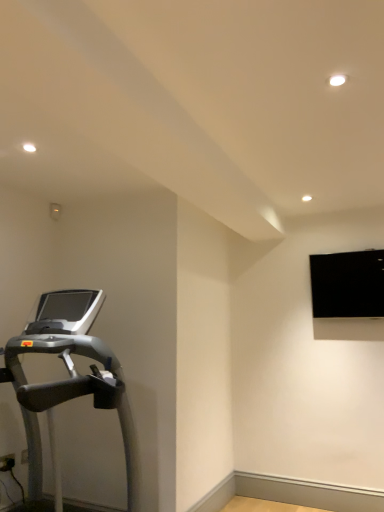
Question: Should I look upward or downward to see black matte projection screen at upper right?

Choices:
 (A) up
 (B) down

Answer: (B)

Question: Does black matte projection screen at upper right have a smaller size compared to silver metallic treadmill at left?

Choices:
 (A) yes
 (B) no

Answer: (A)

Question: From the image's perspective, is black matte projection screen at upper right over silver metallic treadmill at left?

Choices:
 (A) yes
 (B) no

Answer: (A)

Question: Is black matte projection screen at upper right far from silver metallic treadmill at left?

Choices:
 (A) yes
 (B) no

Answer: (A)

Question: Does black matte projection screen at upper right appear on the right side of silver metallic treadmill at left?

Choices:
 (A) yes
 (B) no

Answer: (A)

Question: From a real-world perspective, is black matte projection screen at upper right physically below silver metallic treadmill at left?

Choices:
 (A) no
 (B) yes

Answer: (A)

Question: Can you confirm if black matte projection screen at upper right is wider than silver metallic treadmill at left?

Choices:
 (A) no
 (B) yes

Answer: (A)

Question: Is silver metallic treadmill at left shorter than black matte projection screen at upper right?

Choices:
 (A) yes
 (B) no

Answer: (B)

Question: From a real-world perspective, does silver metallic treadmill at left sit lower than black matte projection screen at upper right?

Choices:
 (A) no
 (B) yes

Answer: (B)

Question: Can you confirm if silver metallic treadmill at left is positioned to the right of black matte projection screen at upper right?

Choices:
 (A) yes
 (B) no

Answer: (B)

Question: Is the depth of silver metallic treadmill at left less than that of black matte projection screen at upper right?

Choices:
 (A) no
 (B) yes

Answer: (B)

Question: Is silver metallic treadmill at left thinner than black matte projection screen at upper right?

Choices:
 (A) no
 (B) yes

Answer: (A)

Question: Is silver metallic treadmill at left wider than black matte projection screen at upper right?

Choices:
 (A) yes
 (B) no

Answer: (A)

Question: Is silver metallic treadmill at left spatially inside black matte projection screen at upper right, or outside of it?

Choices:
 (A) inside
 (B) outside

Answer: (B)